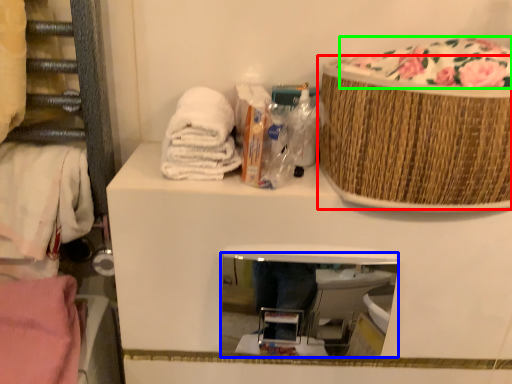
Question: Estimate the real-world distances between objects in this image. Which object is farther from basket (highlighted by a red box), mirror (highlighted by a blue box) or food (highlighted by a green box)?

Choices:
 (A) mirror
 (B) food

Answer: (A)